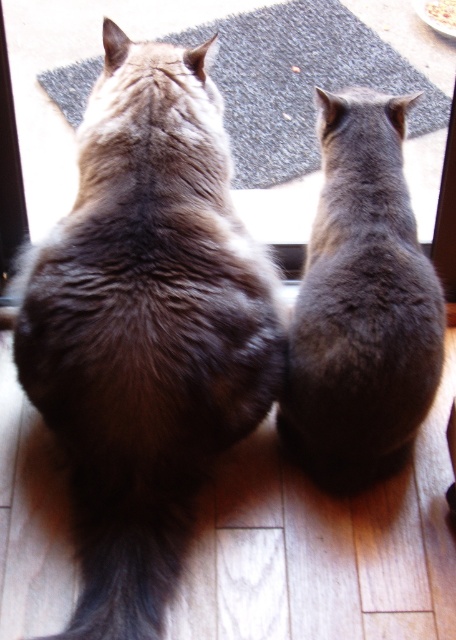
Question: Is brown fur cat at upper left thinner than gray fur cat at center?

Choices:
 (A) yes
 (B) no

Answer: (B)

Question: Which of the following is the farthest from the observer?

Choices:
 (A) brown fur cat at upper left
 (B) white paper plate at upper center

Answer: (B)

Question: Observing the image, what is the correct spatial positioning of brown fur cat at upper left in reference to white paper plate at upper center?

Choices:
 (A) right
 (B) left

Answer: (B)

Question: Can you confirm if brown fur cat at upper left is positioned below gray fur cat at center?

Choices:
 (A) no
 (B) yes

Answer: (B)

Question: Which point is farther from the camera taking this photo?

Choices:
 (A) (57, 317)
 (B) (363, 364)
 (C) (433, 13)

Answer: (C)

Question: Which point is farther from the camera taking this photo?

Choices:
 (A) (328, 93)
 (B) (124, 483)
 (C) (435, 1)

Answer: (C)